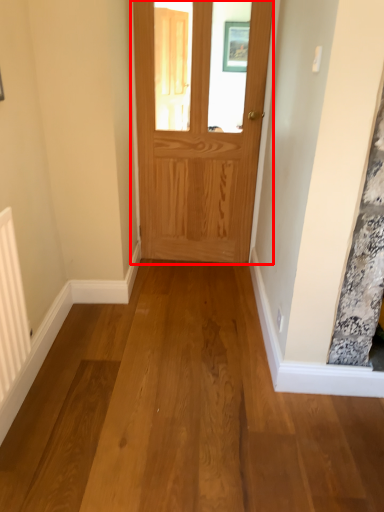
Question: From the image's perspective, considering the relative positions of door (annotated by the red box) and radiator in the image provided, where is door (annotated by the red box) located with respect to the staircase?

Choices:
 (A) above
 (B) below

Answer: (A)